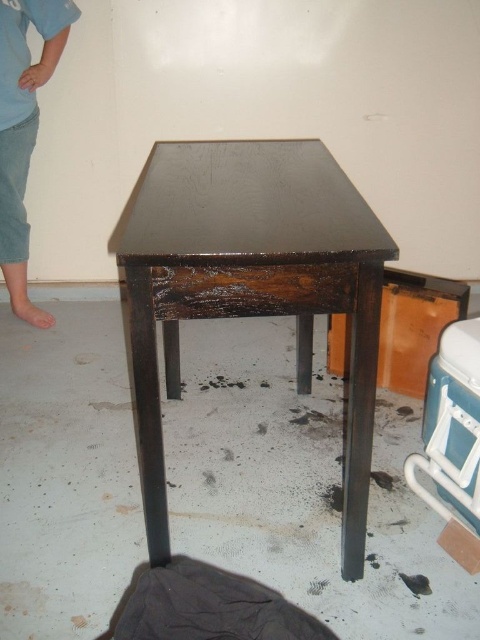
From the picture: You are a construction worker standing in the room. You see the dark wood table at center and the light blue denim pants at left. Which object takes up more space in the room?

The dark wood table at center takes up more space than the light blue denim pants at left because it is bigger.

You are a construction worker standing in the room. You see the dark wood table at center and the light blue denim pants at left. Which object is closer to the floor?

The dark wood table at center is closer to the floor because it is located below the light blue denim pants at left.

You are a contractor assessing the space in the image. The dark wood table at center is currently blocking access to a storage area behind it. Can you estimate whether the table is wider than the light blue denim pants at left, which belong to a worker who needs to pass through?

The dark wood table at center is wider than the light blue denim pants at left, so the worker will have to move the table to pass through.